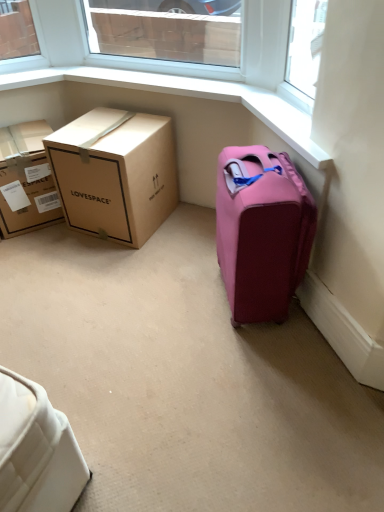
Question: Does clear glass window at upper center lie behind brown cardboard box at left, which appears as the first box when viewed from the left?

Choices:
 (A) yes
 (B) no

Answer: (B)

Question: From a real-world perspective, is clear glass window at upper center under brown cardboard box at left, the second box from the right?

Choices:
 (A) no
 (B) yes

Answer: (A)

Question: Can you confirm if clear glass window at upper center is bigger than brown cardboard box at left, the second box from the right?

Choices:
 (A) yes
 (B) no

Answer: (B)

Question: Does clear glass window at upper center have a lesser height compared to brown cardboard box at left, which appears as the first box when viewed from the left?

Choices:
 (A) no
 (B) yes

Answer: (B)

Question: Can you confirm if clear glass window at upper center is wider than brown cardboard box at left, which appears as the first box when viewed from the left?

Choices:
 (A) no
 (B) yes

Answer: (A)

Question: Looking at their shapes, would you say brown cardboard box at left, which is counted as the first box, starting from the right, is wider or thinner than pink fabric suitcase at right?

Choices:
 (A) wide
 (B) thin

Answer: (A)

Question: Is brown cardboard box at left, which is counted as the first box, starting from the right, bigger or smaller than pink fabric suitcase at right?

Choices:
 (A) small
 (B) big

Answer: (B)

Question: Based on their positions, is brown cardboard box at left, which is counted as the first box, starting from the right, located to the left or right of pink fabric suitcase at right?

Choices:
 (A) left
 (B) right

Answer: (A)

Question: Is brown cardboard box at left, which is counted as the first box, starting from the right, situated inside pink fabric suitcase at right or outside?

Choices:
 (A) outside
 (B) inside

Answer: (A)

Question: Considering the relative positions of pink fabric suitcase at right and brown cardboard box at left, the second box from the right, in the image provided, is pink fabric suitcase at right to the left or to the right of brown cardboard box at left, the second box from the right,?

Choices:
 (A) right
 (B) left

Answer: (A)

Question: Is pink fabric suitcase at right spatially inside brown cardboard box at left, which appears as the first box when viewed from the left, or outside of it?

Choices:
 (A) outside
 (B) inside

Answer: (A)

Question: In terms of height, does pink fabric suitcase at right look taller or shorter compared to brown cardboard box at left, which appears as the first box when viewed from the left?

Choices:
 (A) tall
 (B) short

Answer: (A)

Question: Considering their positions, is pink fabric suitcase at right located in front of or behind brown cardboard box at left, the second box from the right?

Choices:
 (A) front
 (B) behind

Answer: (A)

Question: Does point (288, 232) appear closer or farther from the camera than point (230, 61)?

Choices:
 (A) farther
 (B) closer

Answer: (B)

Question: From a real-world perspective, is pink fabric suitcase at right positioned above or below clear glass window at upper center?

Choices:
 (A) above
 (B) below

Answer: (B)